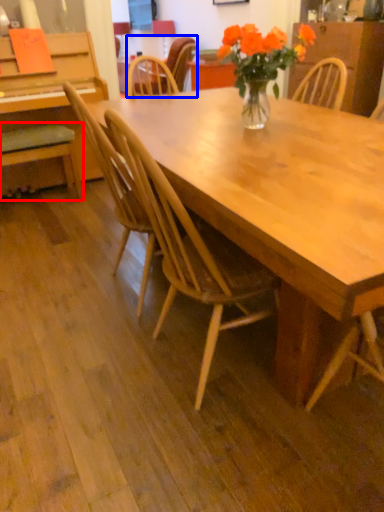
Question: Among these objects, which one is nearest to the camera, chair (highlighted by a red box) or chair (highlighted by a blue box)?

Choices:
 (A) chair
 (B) chair

Answer: (A)